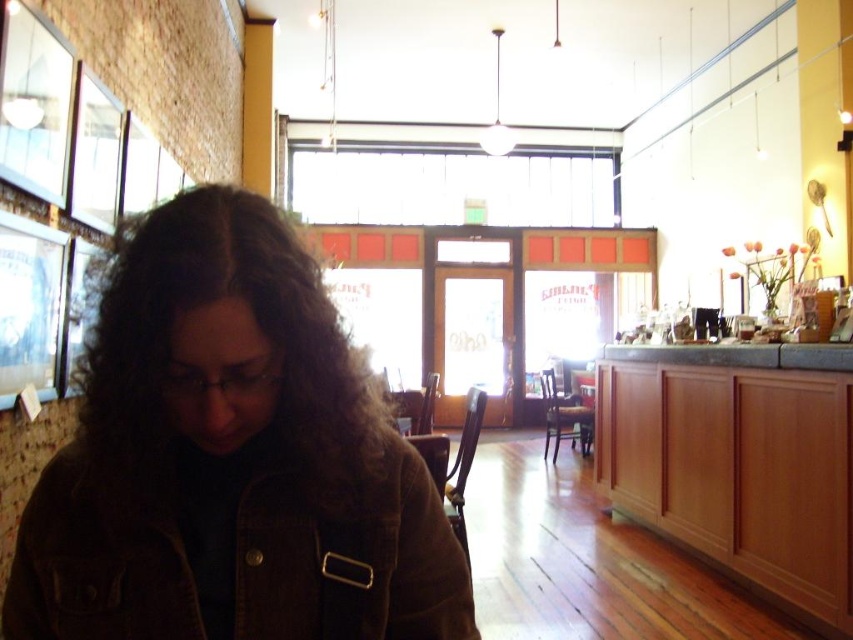
Question: Which of the following is the closest to the observer?

Choices:
 (A) (793, 508)
 (B) (26, 616)

Answer: (B)

Question: Does brown suede jacket at lower left appear on the right side of wooden cabinet at lower right?

Choices:
 (A) yes
 (B) no

Answer: (B)

Question: Among these points, which one is nearest to the camera?

Choices:
 (A) (245, 316)
 (B) (798, 384)

Answer: (A)

Question: Is brown suede jacket at lower left wider than wooden cabinet at lower right?

Choices:
 (A) no
 (B) yes

Answer: (B)

Question: Can you confirm if brown suede jacket at lower left is wider than wooden cabinet at lower right?

Choices:
 (A) yes
 (B) no

Answer: (A)

Question: Which point is closer to the camera?

Choices:
 (A) (154, 365)
 (B) (762, 349)

Answer: (A)